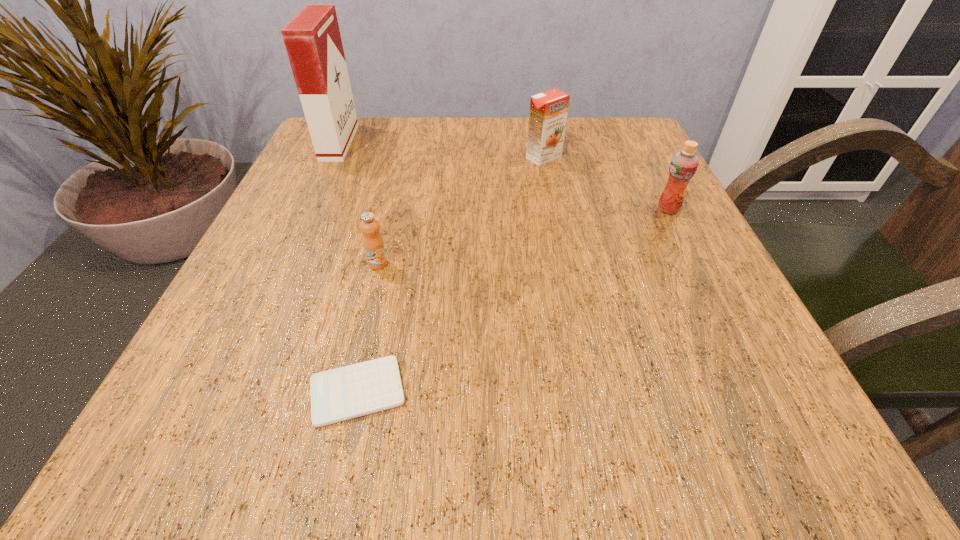
At what (x,y) coordinates should I click in order to perform the action: click on cigarette_case. Please return your answer as a coordinate pair (x, y). Looking at the image, I should click on (x=312, y=38).

Where is `the tallest object`? the tallest object is located at coordinates (312, 38).

Locate an element on the screen. the second orange juice from left to right is located at coordinates (548, 113).

Identify the location of the second object from right to left. This screenshot has height=540, width=960. (548, 113).

The height and width of the screenshot is (540, 960). Find the location of `the second farthest orange juice`. the second farthest orange juice is located at coordinates (684, 163).

The image size is (960, 540). In order to click on the rightmost object in this screenshot , I will do `click(684, 163)`.

Identify the location of the second shortest object. (373, 243).

Locate an element on the screen. The height and width of the screenshot is (540, 960). the shortest orange juice is located at coordinates (373, 243).

Identify the location of the nearest object. (360, 389).

Find the location of a particular element. the shortest object is located at coordinates (360, 389).